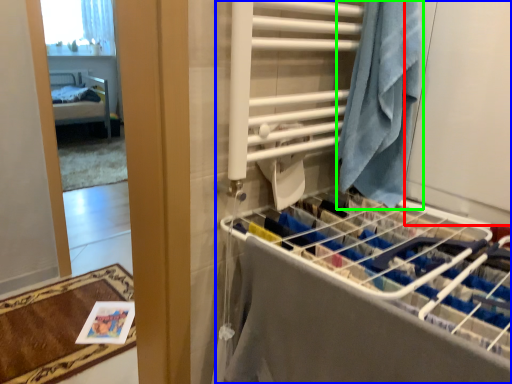
Question: Which object is positioned farthest from screen door (highlighted by a red box)? Select from closet (highlighted by a blue box) and beach towel (highlighted by a green box).

Choices:
 (A) closet
 (B) beach towel

Answer: (A)